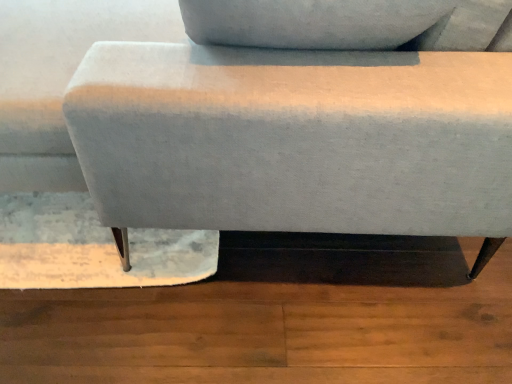
What is the approximate width of light gray fabric couch at center?

light gray fabric couch at center is 5.26 feet in width.

The width and height of the screenshot is (512, 384). I want to click on light gray fabric couch at center, so click(256, 131).

This screenshot has height=384, width=512. Describe the element at coordinates (256, 131) in the screenshot. I see `light gray fabric couch at center` at that location.

What is the approximate height of light gray fabric couch at center?

It is 26.29 inches.

Locate an element on the screen. The height and width of the screenshot is (384, 512). light gray fabric couch at center is located at coordinates (256, 131).